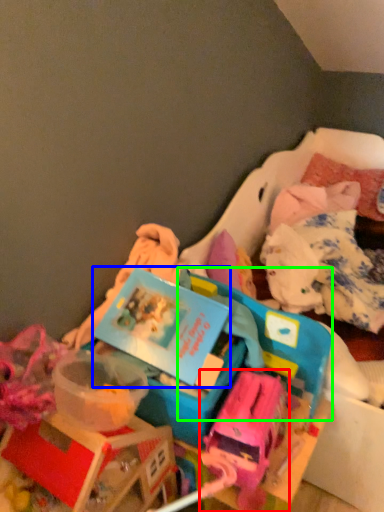
Question: Estimate the real-world distances between objects in this image. Which object is farther from toy (highlighted by a red box), kit (highlighted by a blue box) or storage box (highlighted by a green box)?

Choices:
 (A) kit
 (B) storage box

Answer: (A)